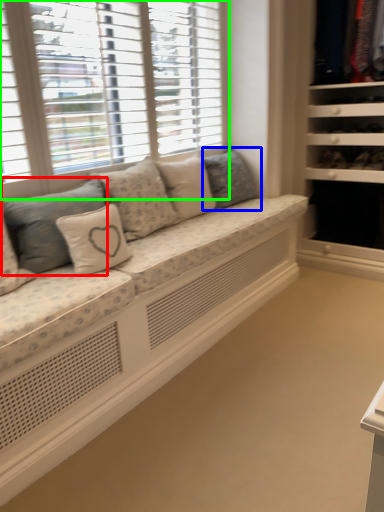
Question: Which is nearer to the pillow (highlighted by a red box)? pillow (highlighted by a blue box) or window (highlighted by a green box).

Choices:
 (A) pillow
 (B) window

Answer: (B)